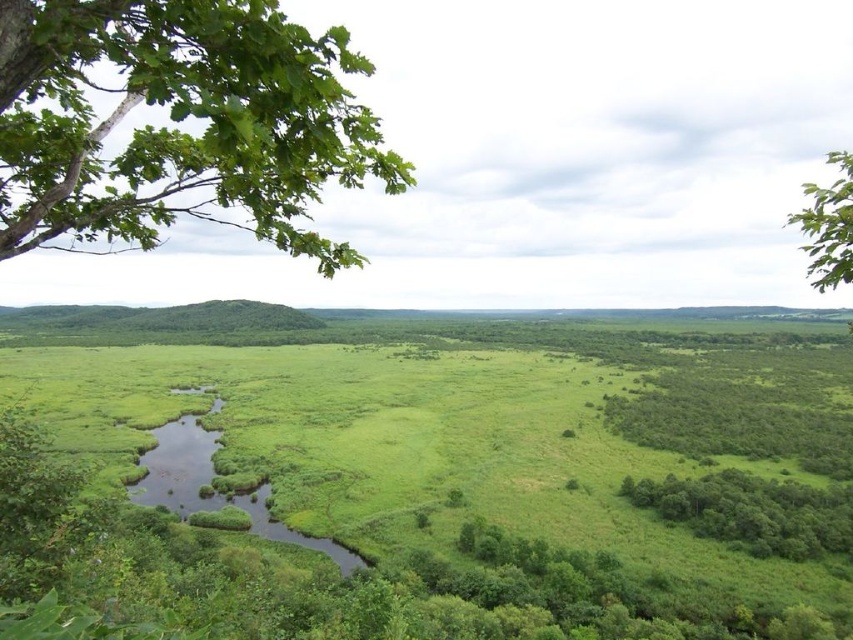
Consider the image. You are standing in the middle of the landscape and notice a green leafy branch at upper left and green leafy trees at lower right. Which object is positioned higher in the image?

The green leafy branch at upper left is positioned higher than the green leafy trees at lower right.

You are a bird flying over the landscape and want to land on the closest green leafy trees. Which one should you choose between the green leafy trees at lower right and the green leafy tree at upper right?

The green leafy trees at lower right occupies less space than the green leafy tree at upper right, so the green leafy trees at lower right is closer to you and you should land there.